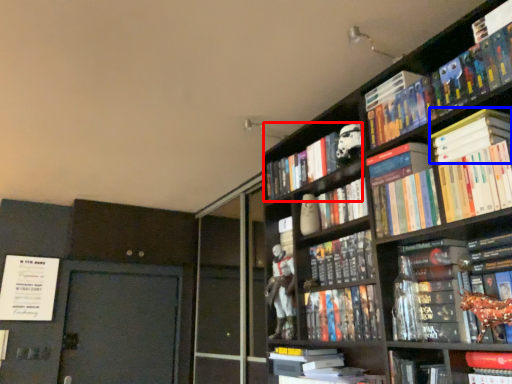
Question: Which point is further to the camera, book (highlighted by a red box) or book (highlighted by a blue box)?

Choices:
 (A) book
 (B) book

Answer: (A)